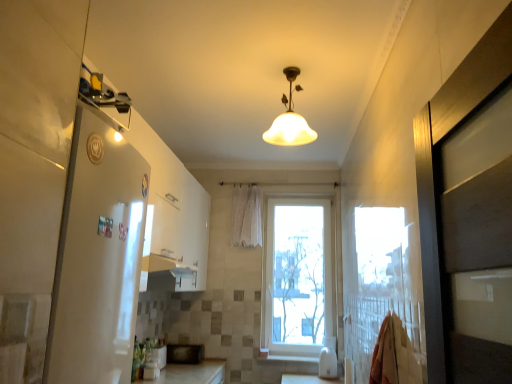
Question: In terms of height, does matte glass lampshade at center look taller or shorter compared to white glossy refrigerator at left?

Choices:
 (A) tall
 (B) short

Answer: (B)

Question: Visually, is matte glass lampshade at center positioned to the left or to the right of white glossy refrigerator at left?

Choices:
 (A) right
 (B) left

Answer: (A)

Question: Which object is positioned closest to the white glossy wood at lower center?

Choices:
 (A) white plastic window at center
 (B) white glossy refrigerator at left
 (C) white glossy microwave at lower center, acting as the first appliance starting from the front
 (D) white sheer curtain at center
 (E) black matte microwave at center, which is counted as the first appliance, starting from the back

Answer: (A)

Question: Which is nearer to the matte glass lampshade at center?

Choices:
 (A) white glossy microwave at lower center, acting as the first appliance starting from the front
 (B) white sheer curtain at center
 (C) white glossy refrigerator at left
 (D) white plastic window at center
 (E) white glossy wood at lower center

Answer: (C)